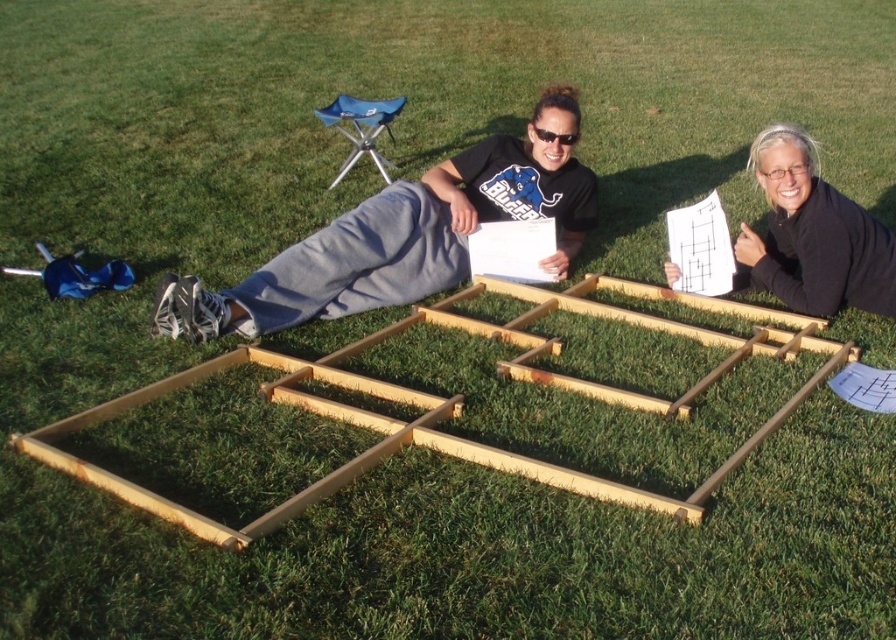
Does gray fabric pants at center appear under black matte paper at upper right?

Correct, gray fabric pants at center is located below black matte paper at upper right.

Between point (213, 323) and point (770, 216), which one is positioned in front?

Point (213, 323) is in front.

Does point (553, 259) lie in front of point (770, 228)?

That is False.

The width and height of the screenshot is (896, 640). Find the location of `gray fabric pants at center`. gray fabric pants at center is located at coordinates (403, 236).